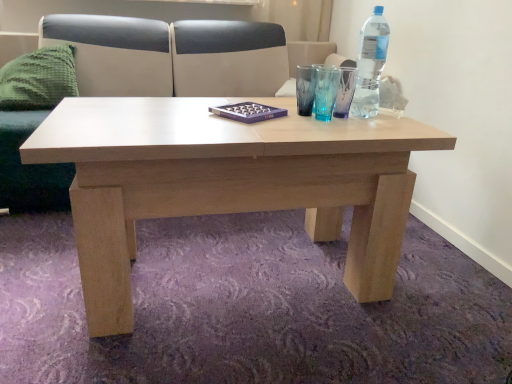
Question: Is clear plastic bottle at upper right next to green knitted pillow at left and touching it?

Choices:
 (A) no
 (B) yes

Answer: (A)

Question: Does clear plastic bottle at upper right appear on the left side of green knitted pillow at left?

Choices:
 (A) no
 (B) yes

Answer: (A)

Question: Is clear plastic bottle at upper right bigger than green knitted pillow at left?

Choices:
 (A) yes
 (B) no

Answer: (B)

Question: From the image's perspective, does clear plastic bottle at upper right appear lower than green knitted pillow at left?

Choices:
 (A) no
 (B) yes

Answer: (B)

Question: From a real-world perspective, is clear plastic bottle at upper right physically below green knitted pillow at left?

Choices:
 (A) yes
 (B) no

Answer: (B)

Question: From the image's perspective, is green knitted pillow at left located above or below light beige leather couch at upper center?

Choices:
 (A) below
 (B) above

Answer: (B)

Question: Considering the positions of point (19, 87) and point (59, 178), is point (19, 87) closer or farther from the camera than point (59, 178)?

Choices:
 (A) closer
 (B) farther

Answer: (B)

Question: Is green knitted pillow at left bigger or smaller than light beige leather couch at upper center?

Choices:
 (A) small
 (B) big

Answer: (A)

Question: Is green knitted pillow at left to the left or to the right of light beige leather couch at upper center in the image?

Choices:
 (A) right
 (B) left

Answer: (B)

Question: Is light beige leather couch at upper center spatially inside green knitted pillow at left, or outside of it?

Choices:
 (A) inside
 (B) outside

Answer: (B)

Question: Is point (88, 18) closer or farther from the camera than point (32, 61)?

Choices:
 (A) closer
 (B) farther

Answer: (B)

Question: Looking at their shapes, would you say light beige leather couch at upper center is wider or thinner than green knitted pillow at left?

Choices:
 (A) thin
 (B) wide

Answer: (B)

Question: In the image, is light beige leather couch at upper center positioned in front of or behind green knitted pillow at left?

Choices:
 (A) front
 (B) behind

Answer: (A)

Question: From a real-world perspective, is green knitted pillow at left physically located above or below clear plastic bottle at upper right?

Choices:
 (A) above
 (B) below

Answer: (B)

Question: Looking at the image, does green knitted pillow at left seem bigger or smaller compared to clear plastic bottle at upper right?

Choices:
 (A) big
 (B) small

Answer: (A)